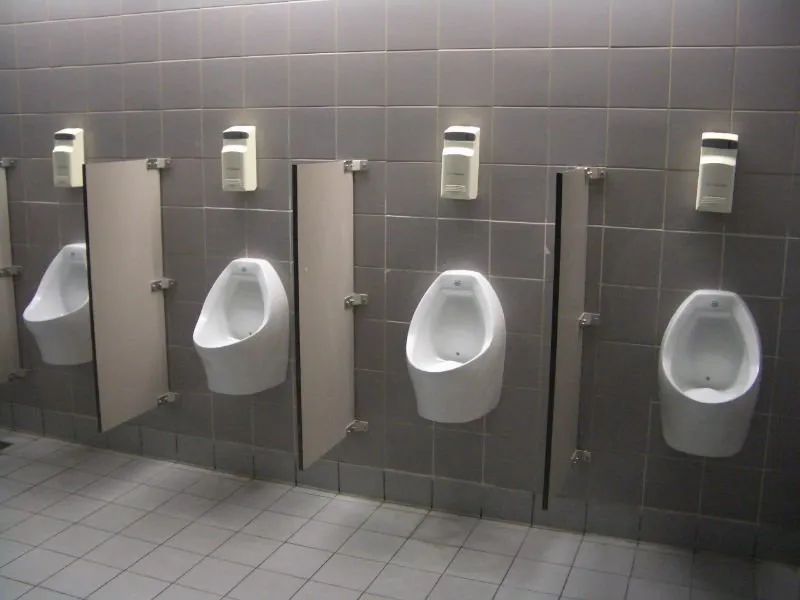
Locate an element on the screen. The height and width of the screenshot is (600, 800). sanitizer dispeners is located at coordinates (58, 169), (232, 171), (460, 157), (706, 166).